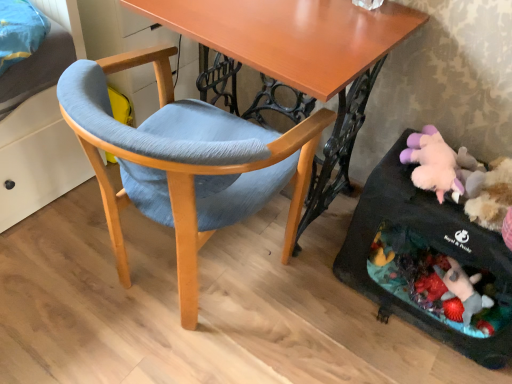
Where is `black fabric baby carriage at lower right`? The image size is (512, 384). black fabric baby carriage at lower right is located at coordinates (432, 243).

Where is `matte blue fabric chair at center`? This screenshot has height=384, width=512. matte blue fabric chair at center is located at coordinates (185, 163).

Find the location of a particular element. The image size is (512, 384). black fabric baby carriage at lower right is located at coordinates (432, 243).

Looking at their sizes, would you say black fabric baby carriage at lower right is wider or thinner than wooden desk at center?

Clearly, black fabric baby carriage at lower right has less width compared to wooden desk at center.

Consider the image. From a real-world perspective, which is physically below, black fabric baby carriage at lower right or wooden desk at center?

black fabric baby carriage at lower right.

Considering their positions, is black fabric baby carriage at lower right located in front of or behind wooden desk at center?

Visually, black fabric baby carriage at lower right is located behind wooden desk at center.

Identify the location of desk in front of the black fabric baby carriage at lower right. (301, 58).

Is matte blue fabric chair at center placed right next to wooden desk at center?

No, matte blue fabric chair at center is not with wooden desk at center.

Can you tell me how much matte blue fabric chair at center and wooden desk at center differ in facing direction?

The angular difference between matte blue fabric chair at center and wooden desk at center is 180 degrees.

Between matte blue fabric chair at center and wooden desk at center, which one has less height?

matte blue fabric chair at center is shorter.

Considering the relative sizes of matte blue fabric chair at center and wooden desk at center in the image provided, is matte blue fabric chair at center bigger than wooden desk at center?

No, matte blue fabric chair at center is not bigger than wooden desk at center.

From the image's perspective, who appears lower, wooden desk at center or matte blue fabric chair at center?

From the image's view, matte blue fabric chair at center is below.

Based on the photo, is wooden desk at center touching matte blue fabric chair at center?

wooden desk at center and matte blue fabric chair at center are clearly separated.

What's the angular difference between wooden desk at center and matte blue fabric chair at center's facing directions?

There is a 180-degree angle between the facing directions of wooden desk at center and matte blue fabric chair at center.

From a real-world perspective, is black fabric baby carriage at lower right on matte blue fabric chair at center?

Incorrect, from a real-world perspective, black fabric baby carriage at lower right is lower than matte blue fabric chair at center.

Which point is more forward, (447, 340) or (212, 118)?

The point (447, 340) is more forward.

Is black fabric baby carriage at lower right placed right next to matte blue fabric chair at center?

They are not placed beside each other.

Considering the sizes of objects black fabric baby carriage at lower right and matte blue fabric chair at center in the image provided, who is bigger, black fabric baby carriage at lower right or matte blue fabric chair at center?

matte blue fabric chair at center.

Is wooden desk at center positioned with its back to black fabric baby carriage at lower right?

No.

From the picture: From a real-world perspective, relative to black fabric baby carriage at lower right, is wooden desk at center vertically above or below?

Clearly, from a real-world perspective, wooden desk at center is above black fabric baby carriage at lower right.

Between wooden desk at center and black fabric baby carriage at lower right, which one appears on the right side from the viewer's perspective?

black fabric baby carriage at lower right.

Who is bigger, wooden desk at center or black fabric baby carriage at lower right?

With larger size is wooden desk at center.

Is matte blue fabric chair at center positioned behind black fabric baby carriage at lower right?

No, it is not.

Can you tell me how much matte blue fabric chair at center and black fabric baby carriage at lower right differ in facing direction?

The angle between the facing direction of matte blue fabric chair at center and the facing direction of black fabric baby carriage at lower right is 180 degrees.

Where is `chair lying in front of the black fabric baby carriage at lower right`? Image resolution: width=512 pixels, height=384 pixels. chair lying in front of the black fabric baby carriage at lower right is located at coordinates (185, 163).

Is matte blue fabric chair at center taller than black fabric baby carriage at lower right?

Yes, matte blue fabric chair at center is taller than black fabric baby carriage at lower right.

Locate an element on the screen. desk above the black fabric baby carriage at lower right (from the image's perspective) is located at coordinates (301, 58).

The height and width of the screenshot is (384, 512). I want to click on desk positioned vertically above the matte blue fabric chair at center (from a real-world perspective), so click(x=301, y=58).

When comparing their distances from matte blue fabric chair at center, does wooden desk at center or black fabric baby carriage at lower right seem closer?

wooden desk at center is positioned closer to the anchor matte blue fabric chair at center.

Estimate the real-world distances between objects in this image. Which object is further from wooden desk at center, black fabric baby carriage at lower right or matte blue fabric chair at center?

black fabric baby carriage at lower right is further to wooden desk at center.

From the picture: When comparing their distances from matte blue fabric chair at center, does black fabric baby carriage at lower right or wooden desk at center seem further?

black fabric baby carriage at lower right is further to matte blue fabric chair at center.

When comparing their distances from black fabric baby carriage at lower right, does matte blue fabric chair at center or wooden desk at center seem further?

matte blue fabric chair at center is positioned further to the anchor black fabric baby carriage at lower right.

Looking at the image, which one is located closer to wooden desk at center, matte blue fabric chair at center or black fabric baby carriage at lower right?

Based on the image, matte blue fabric chair at center appears to be nearer to wooden desk at center.

Looking at this image, based on their spatial positions, is wooden desk at center or matte blue fabric chair at center closer to black fabric baby carriage at lower right?

Among the two, wooden desk at center is located nearer to black fabric baby carriage at lower right.

I want to click on desk situated between matte blue fabric chair at center and black fabric baby carriage at lower right from left to right, so click(301, 58).